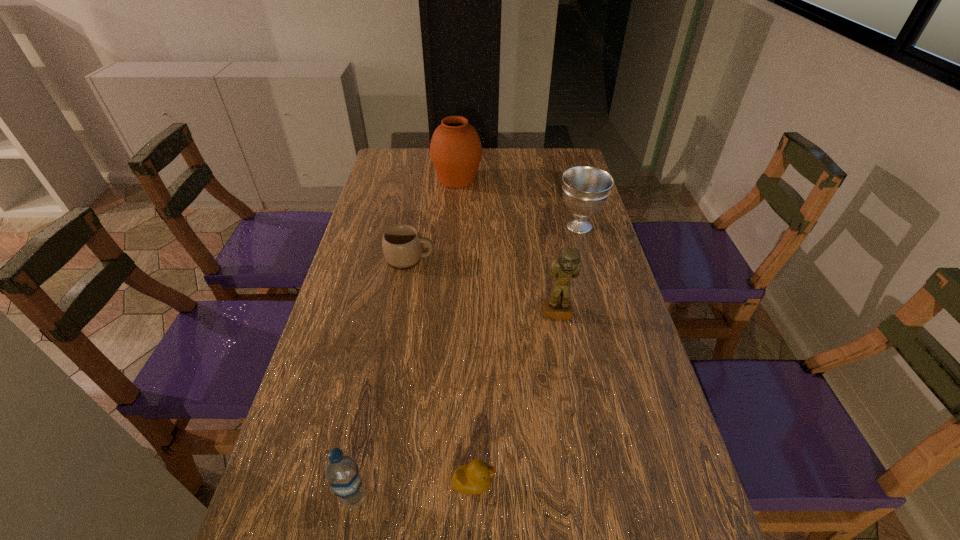
The width and height of the screenshot is (960, 540). Identify the location of blank space located 0.280m on the front-facing side of the fifth object from left to right. (576, 422).

Identify the location of free point located on the front of the chalice. (591, 271).

What are the coordinates of `free space located on the side of the mug with the handle` in the screenshot? It's located at [x=450, y=258].

The width and height of the screenshot is (960, 540). What are the coordinates of `vacant space located 0.220m on the face of the shortest object` in the screenshot? It's located at (610, 483).

At what (x,y) coordinates should I click in order to perform the action: click on object located in the far edge section of the desktop. Please return your answer as a coordinate pair (x, y). Image resolution: width=960 pixels, height=540 pixels. Looking at the image, I should click on (455, 149).

Identify the location of water bottle located in the left edge section of the desktop. 341,469.

Locate an element on the screen. This screenshot has width=960, height=540. mug that is at the left edge is located at coordinates (402, 245).

This screenshot has height=540, width=960. What are the coordinates of `figurine at the right edge` in the screenshot? It's located at (568, 264).

In order to click on chalice that is positioned at the right edge in this screenshot , I will do `click(585, 188)`.

Locate an element on the screen. The width and height of the screenshot is (960, 540). free space at the left edge of the desktop is located at coordinates (365, 206).